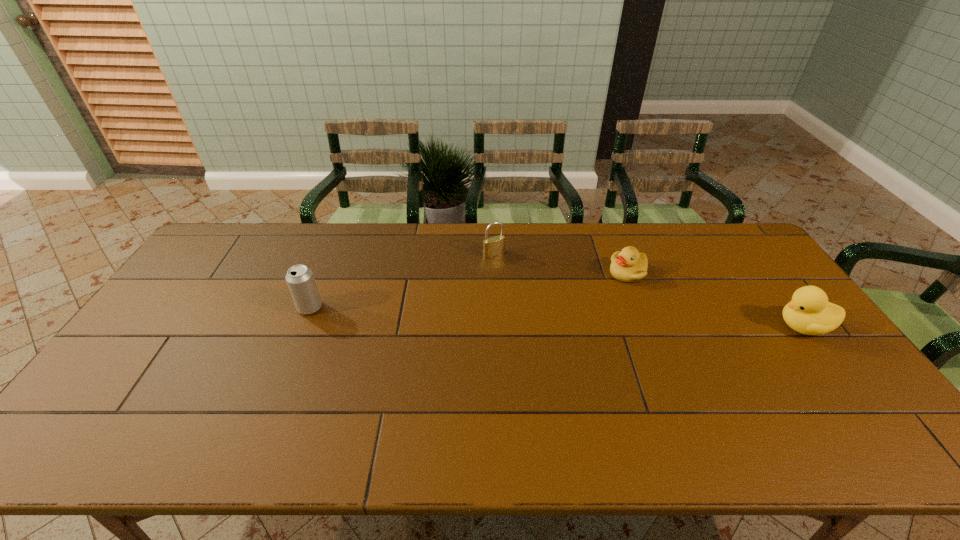
Where is `free space at the near edge of the desktop`? The image size is (960, 540). free space at the near edge of the desktop is located at coordinates (352, 393).

Locate an element on the screen. This screenshot has width=960, height=540. vacant region at the left edge of the desktop is located at coordinates (212, 308).

In the image, there is a desktop. Where is `vacant region at the right edge`? This screenshot has width=960, height=540. vacant region at the right edge is located at coordinates (761, 322).

Identify the location of free spot at the far left corner of the desktop. (220, 239).

In the image, there is a desktop. Where is `vacant space at the near left corner`? The image size is (960, 540). vacant space at the near left corner is located at coordinates (108, 414).

Find the location of a particular element. The height and width of the screenshot is (540, 960). vacant point located between the third object from right to left and the duckling is located at coordinates (561, 264).

Locate an element on the screen. empty space that is in between the duck and the third object from right to left is located at coordinates (649, 291).

At what (x,y) coordinates should I click in order to perform the action: click on free space between the third object from right to left and the leftmost object. Please return your answer as a coordinate pair (x, y). This screenshot has width=960, height=540. Looking at the image, I should click on (402, 281).

Find the location of `free point between the leftmost object and the third nearest object`. free point between the leftmost object and the third nearest object is located at coordinates (468, 290).

Find the location of `empty location between the duck and the beer can`. empty location between the duck and the beer can is located at coordinates (557, 317).